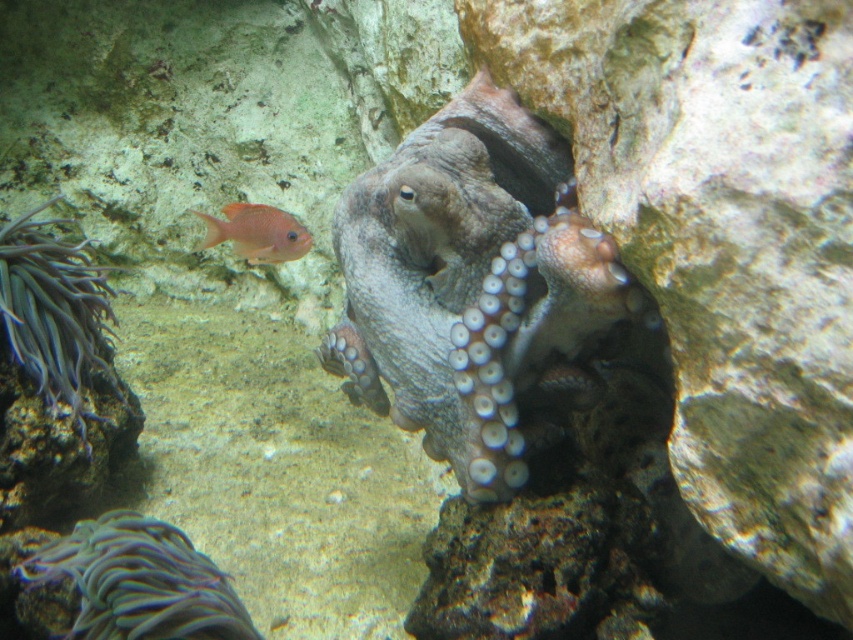
Question: Does grayish-blue soft coral at lower left lie in front of matte orange fish at left?

Choices:
 (A) yes
 (B) no

Answer: (A)

Question: Can you confirm if gray soft anemone at left is positioned below matte orange fish at left?

Choices:
 (A) no
 (B) yes

Answer: (B)

Question: Among these points, which one is nearest to the camera?

Choices:
 (A) (560, 314)
 (B) (85, 272)
 (C) (253, 237)

Answer: (A)

Question: Which of the following is the farthest from the observer?

Choices:
 (A) (74, 560)
 (B) (250, 259)

Answer: (B)

Question: Can you confirm if gray matte octopus at center is positioned above gray soft anemone at left?

Choices:
 (A) yes
 (B) no

Answer: (A)

Question: Which point is farther from the camera taking this photo?

Choices:
 (A) (74, 588)
 (B) (476, 460)
 (C) (293, 257)
 (D) (80, 420)

Answer: (C)